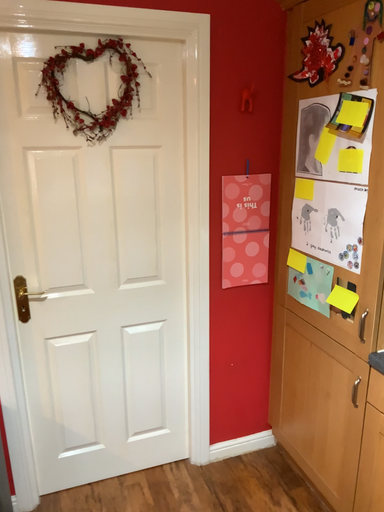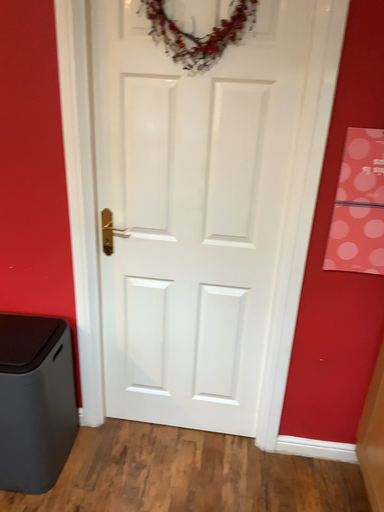
Question: Which way did the camera rotate in the video?

Choices:
 (A) rotated left
 (B) rotated right

Answer: (A)